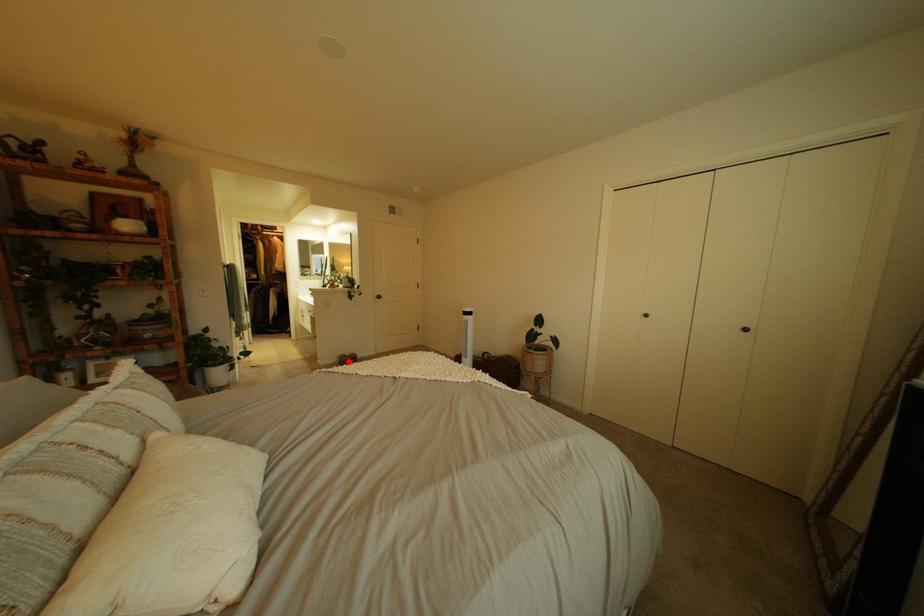
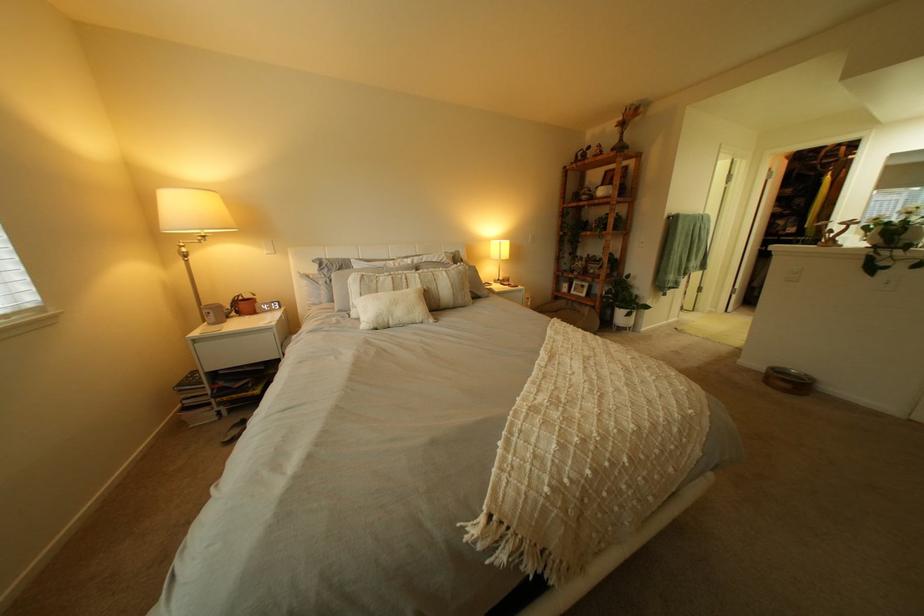
Locate, in the second image, the point that corresponds to the highlighted location in the first image.

(779, 369)